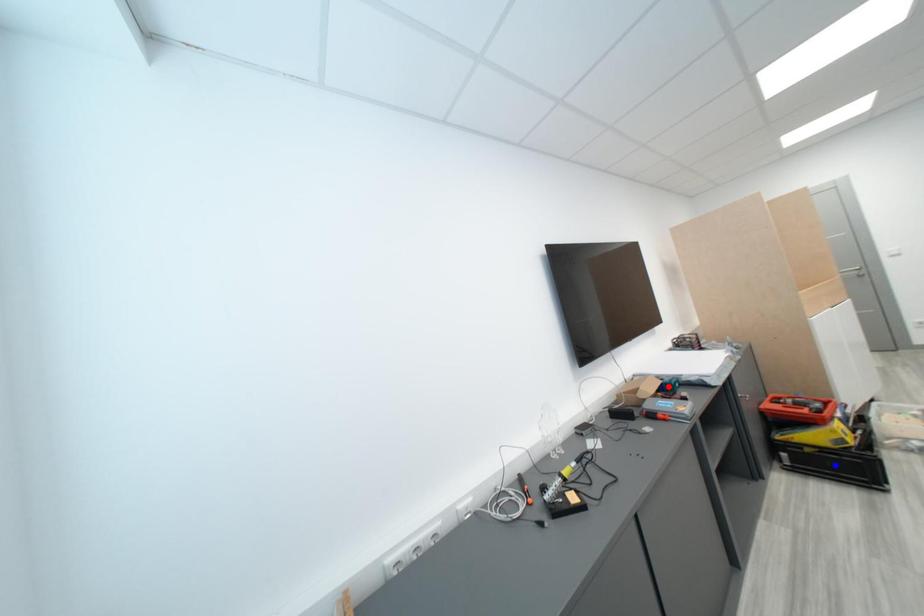
Question: In the image, two points are highlighted. Which point is nearer to the camera? Reply with the corresponding letter.

Choices:
 (A) blue point
 (B) red point

Answer: (A)